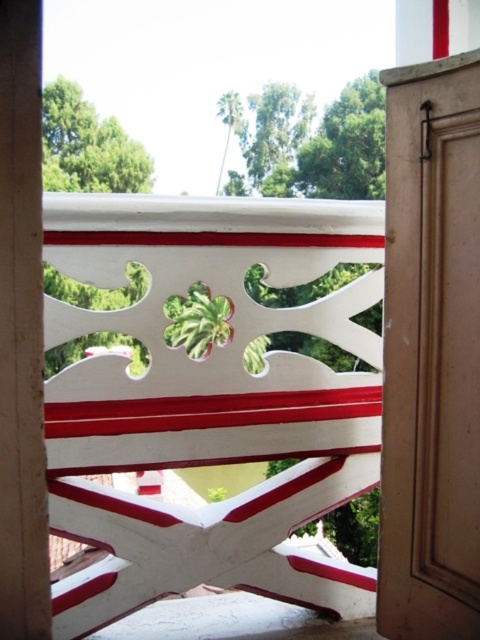
Does matte brown door at right appear over wooden at left?

Indeed, matte brown door at right is positioned over wooden at left.

Is the position of matte brown door at right less distant than that of wooden at left?

No, it is not.

Is point (458, 586) in front of point (34, 109)?

No, (458, 586) is behind (34, 109).

I want to click on matte brown door at right, so click(431, 353).